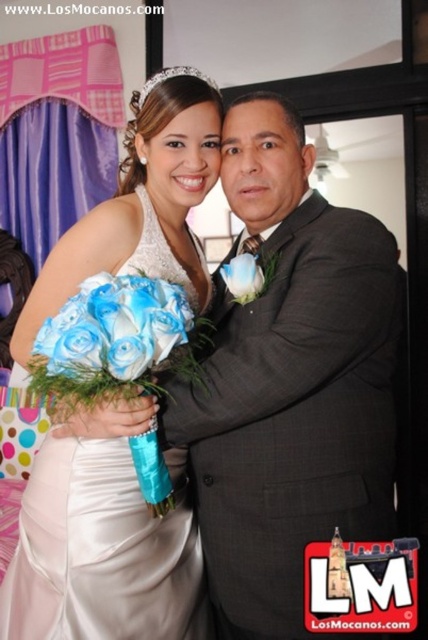
Question: Can you confirm if satin white dress at center is wider than blue silk flower at center?

Choices:
 (A) yes
 (B) no

Answer: (A)

Question: Which of these objects is positioned closest to the blue silk flower at center?

Choices:
 (A) blue silk roses at center
 (B) clear crystal tiara at upper center
 (C) satin white dress at center

Answer: (A)

Question: Does satin white dress at center lie behind clear crystal tiara at upper center?

Choices:
 (A) no
 (B) yes

Answer: (A)

Question: Can you confirm if blue silk roses at center is smaller than blue silk flower at center?

Choices:
 (A) yes
 (B) no

Answer: (B)

Question: Which point appears closest to the camera in this image?

Choices:
 (A) (109, 356)
 (B) (252, 612)
 (C) (247, 273)
 (D) (74, 483)

Answer: (A)

Question: Which point is farther to the camera?

Choices:
 (A) (169, 136)
 (B) (247, 275)
 (C) (175, 68)
 (D) (244, 509)

Answer: (C)